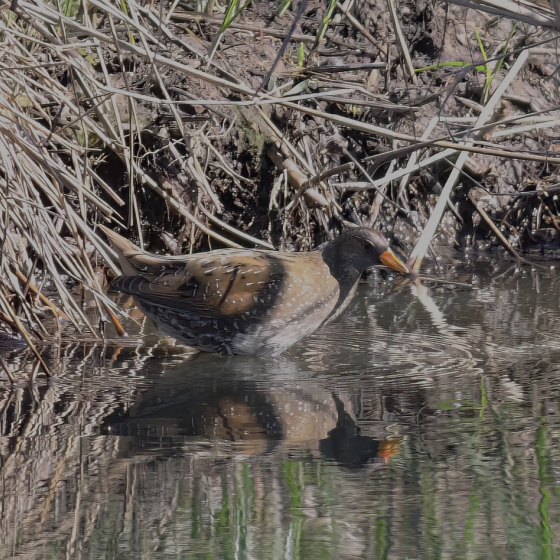
Identify the location of green plant. (230, 21), (321, 35), (491, 79).